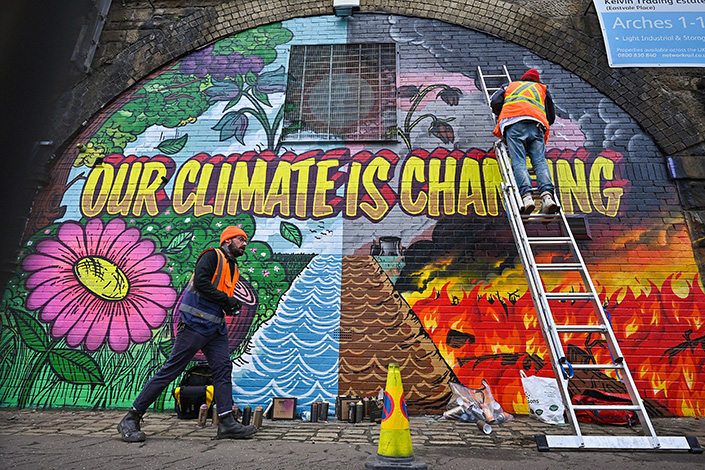
Where is `ladder`? This screenshot has width=705, height=470. ladder is located at coordinates (481, 84).